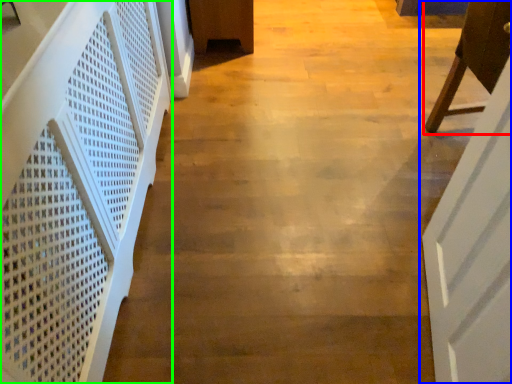
Question: Estimate the real-world distances between objects in this image. Which object is closer to furniture (highlighted by a red box), door (highlighted by a blue box) or stairwell (highlighted by a green box)?

Choices:
 (A) door
 (B) stairwell

Answer: (A)